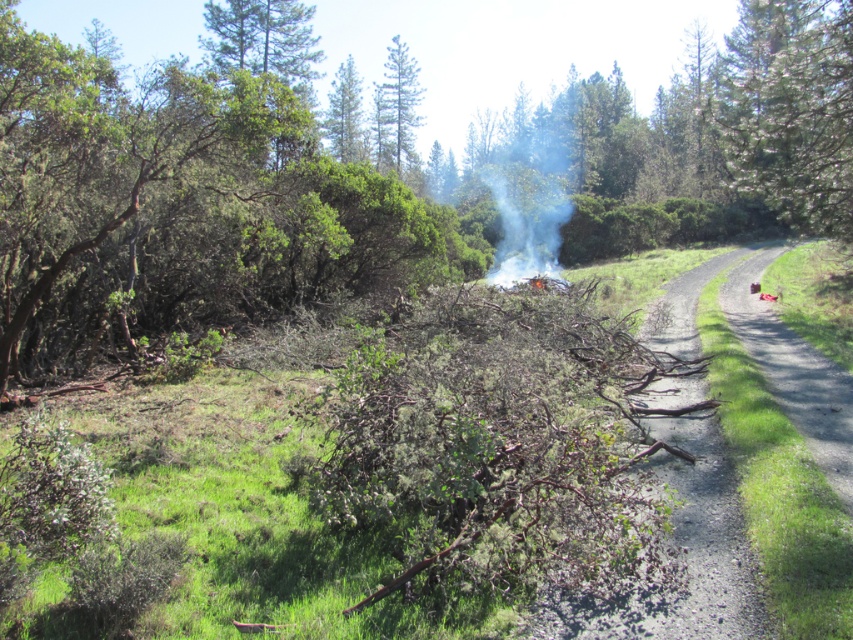
You are a hiker standing on the dirt path and want to take a photo of both the green textured pine tree at upper center and the green leafy tree at upper center. Which tree should you focus on first to ensure both are in clear view?

You should focus on the green textured pine tree at upper center first because it is closer to you than the green leafy tree at upper center, ensuring both are in clear view when focused on the closer one.

You are a hiker who wants to take a photo of the white smoke at center and the green textured pine tree at right. Which object should you focus on first if you want to capture both in a single frame without moving the camera?

You should focus on the green textured pine tree at right first because it is much taller than the white smoke at center, so adjusting focus to the farther object ensures both are in the frame.